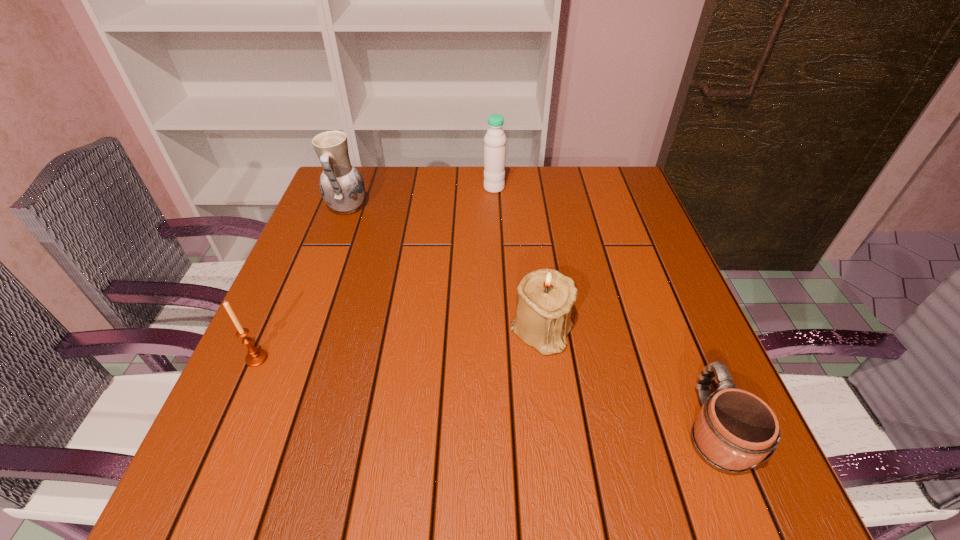
Identify the location of vacant region located 0.060m on the side of the rightmost object with the handle. This screenshot has width=960, height=540. [685, 359].

Identify the location of vacant area situated 0.120m on the side of the rightmost object with the handle. (676, 334).

Image resolution: width=960 pixels, height=540 pixels. Find the location of `free spot located 0.140m on the side of the rightmost object with the handle`. free spot located 0.140m on the side of the rightmost object with the handle is located at coordinates (672, 326).

The image size is (960, 540). Identify the location of water bottle that is positioned at the far edge. (495, 139).

Where is `pottery that is at the far edge`? Image resolution: width=960 pixels, height=540 pixels. pottery that is at the far edge is located at coordinates (341, 185).

Locate an element on the screen. This screenshot has height=540, width=960. object that is at the near edge is located at coordinates [734, 430].

Identify the location of pottery that is at the left edge. (341, 185).

Find the location of `candle_holder situated at the left edge`. candle_holder situated at the left edge is located at coordinates (255, 357).

Locate an element on the screen. object present at the right edge is located at coordinates (734, 430).

Locate an element on the screen. Image resolution: width=960 pixels, height=540 pixels. object at the far left corner is located at coordinates (341, 185).